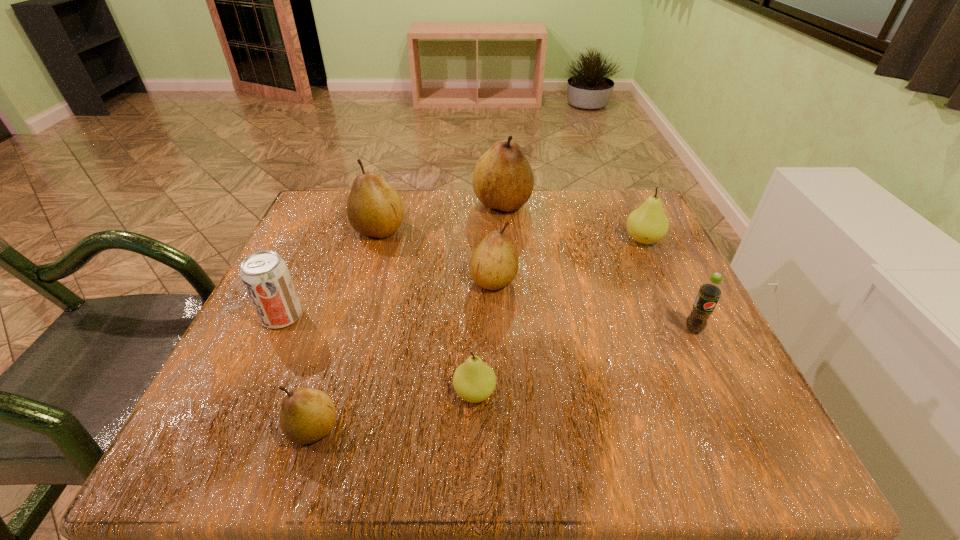
This screenshot has width=960, height=540. In the image, there is a desktop. In order to click on vacant space at the right edge in this screenshot , I will do `click(630, 350)`.

Locate an element on the screen. The width and height of the screenshot is (960, 540). free region at the near left corner of the desktop is located at coordinates (246, 427).

I want to click on free space at the far right corner, so click(636, 201).

In order to click on free space between the second smallest brown pear and the seventh shortest object in this screenshot , I will do `click(436, 255)`.

Locate an element on the screen. This screenshot has height=540, width=960. free space between the third farthest brown pear and the smallest brown pear is located at coordinates (403, 354).

Locate an element on the screen. vacant space that is in between the smallest brown pear and the second tallest object is located at coordinates (347, 329).

I want to click on free space between the third biggest brown pear and the left green pear, so tap(484, 337).

Where is `free space between the nearer green pear and the second tallest pear`? Image resolution: width=960 pixels, height=540 pixels. free space between the nearer green pear and the second tallest pear is located at coordinates click(x=427, y=312).

Find the location of a particular element. The width and height of the screenshot is (960, 540). unoccupied area between the left green pear and the right soda is located at coordinates (584, 361).

The height and width of the screenshot is (540, 960). I want to click on unoccupied area between the rightmost pear and the smallest brown pear, so click(x=478, y=334).